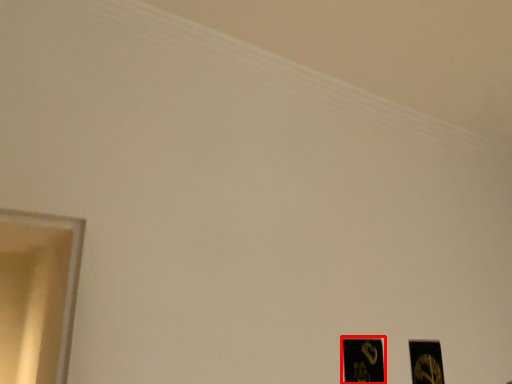
Question: From the image's perspective, what is the correct spatial positioning of picture frame (annotated by the red box) in reference to picture frame?

Choices:
 (A) below
 (B) above

Answer: (B)